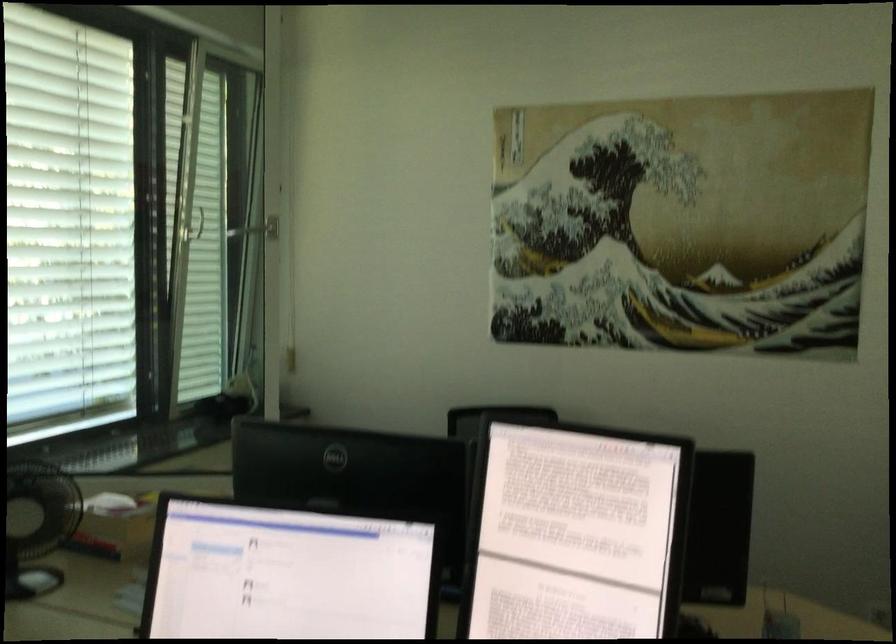
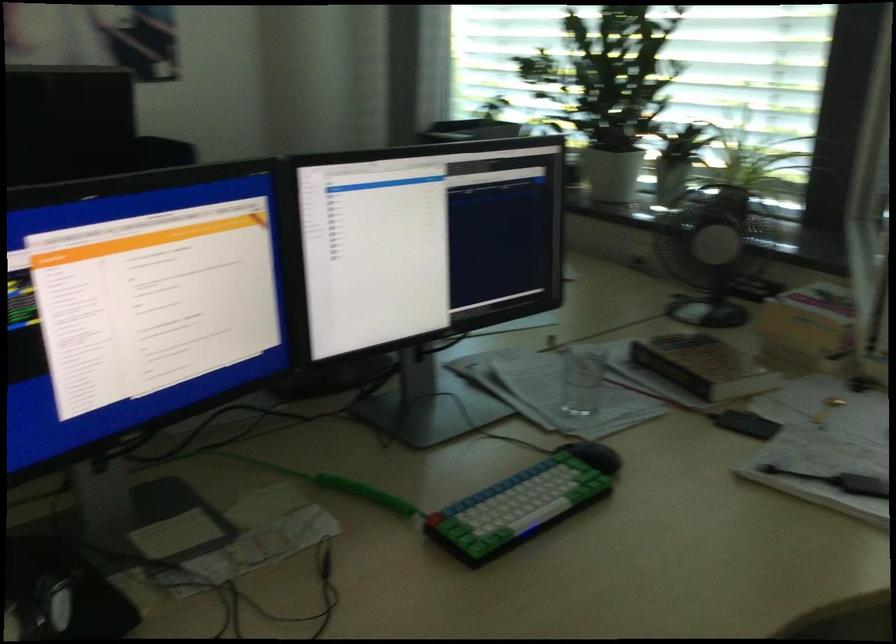
Find the pixel in the second image that matches point (138, 516) in the first image.

(810, 326)